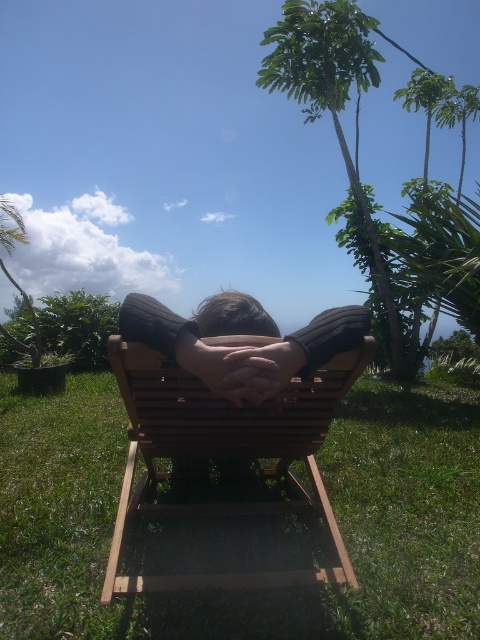
You are standing in the serene outdoor scene and want to take a photo of the green leafy palm tree at upper right without the green grass at lower center blocking the view. Is this possible?

The green grass at lower center is in front of the green leafy palm tree at upper right, so it will block the view. To take a photo of the green leafy palm tree at upper right without the green grass at lower center blocking the view, you need to move to a position where the green grass at lower center is out of the frame or behind you.

You are standing in the middle of the scene and see the wooden beach chair at center and the dark brown sweater at center. Which object is positioned to the left?

The wooden beach chair at center is to the left of the dark brown sweater at center.

You are planning to take a nap in the green grass at lower center. Considering the height of the green leafy palm tree at upper right, will the tree block sunlight reaching the grass where you want to nap?

The green leafy palm tree at upper right is taller than the green grass at lower center, so it may block some sunlight depending on the time of day and the tree canopy density. However, the scene description mentions the area is lush and green with various plants and trees, so partial shading is possible.